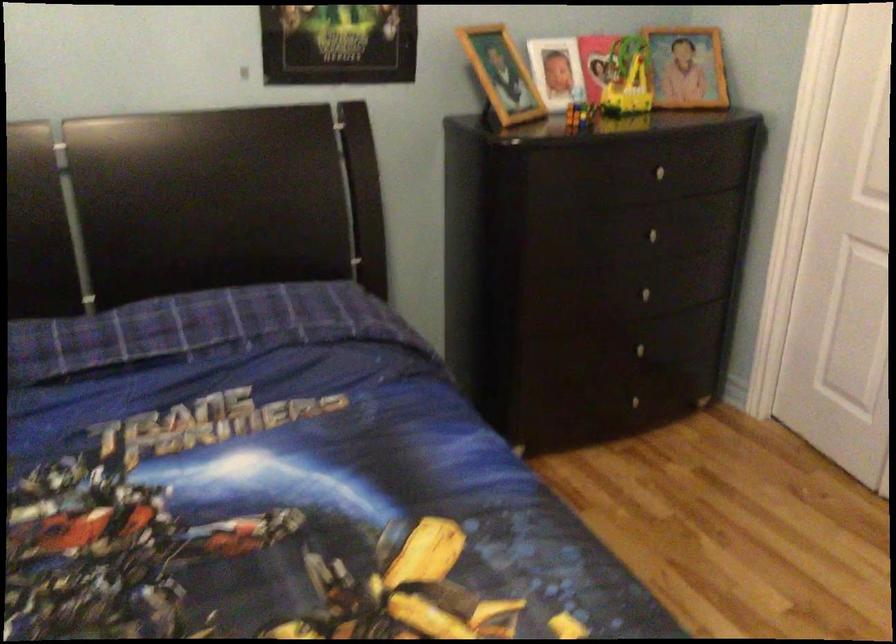
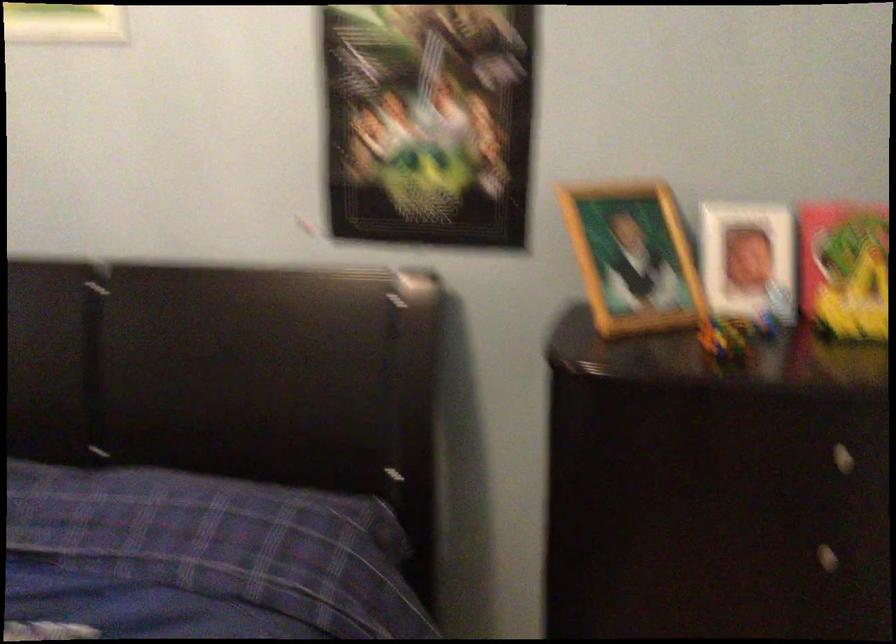
In the second image, find the point that corresponds to [659,174] in the first image.

(840, 458)